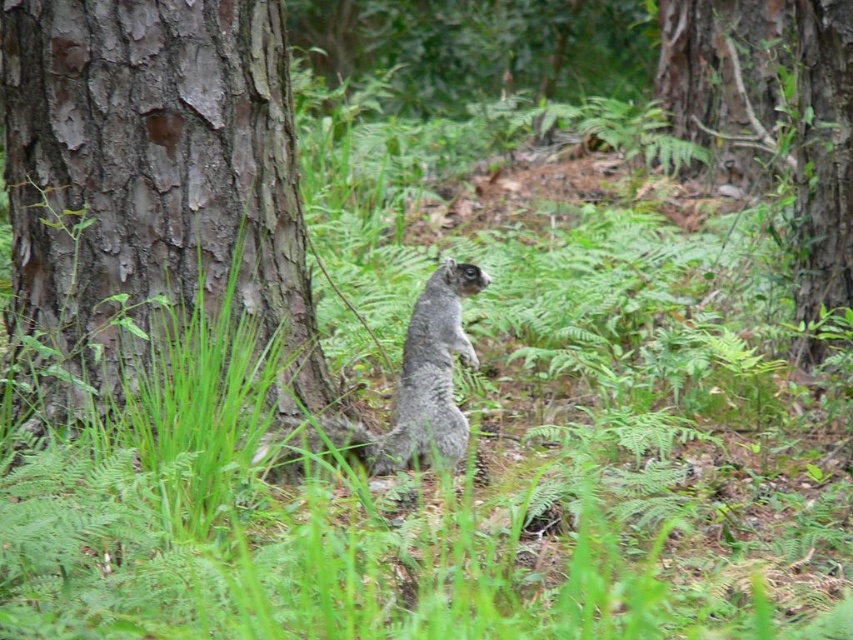
You are a bird flying over the forest and want to land on the brown rough bark tree trunk at left. From your current position above the gray furry squirrel at center, in which direction should you fly to reach the tree trunk?

The brown rough bark tree trunk at left is above the gray furry squirrel at center, so you should fly upward to reach the tree trunk.

You are a hiker who wants to take a photo of the brown rough bark tree trunk at left. The camera you are using has a focus point at coordinates point (152, 184). Will the focus point be on the brown rough bark tree trunk at left?

Yes, the focus point at point (152, 184) marks the brown rough bark tree trunk at left, so the focus point will be on the brown rough bark tree trunk at left.

You are a photographer trying to capture the gray furry squirrel at center. You notice the rough bark tree at center is blocking your view. Is the squirrel visible from your current position?

The gray furry squirrel at center is behind the rough bark tree at center, so it is not visible from your current position.